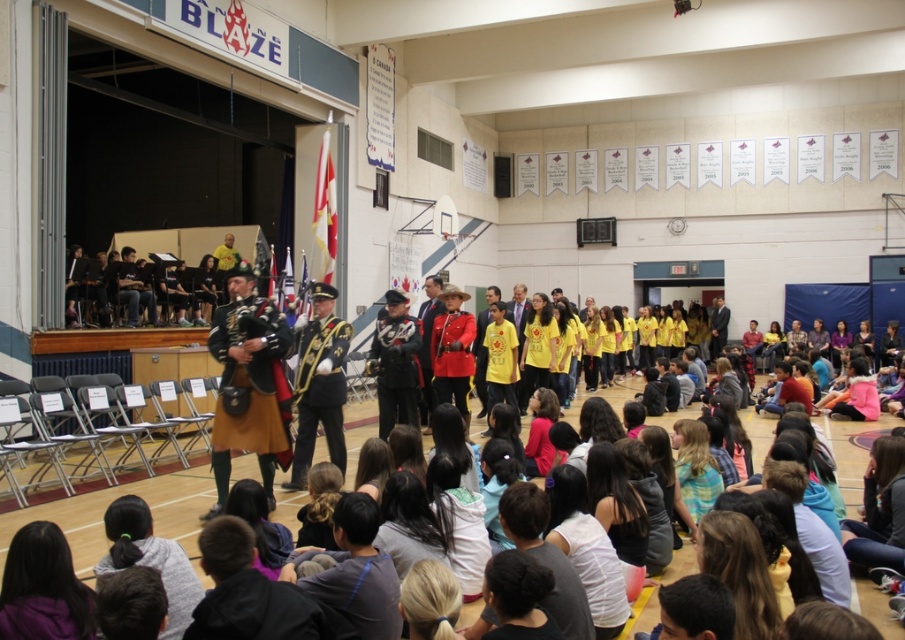
Question: Does brown leather kilt at center appear on the right side of red uniform at center?

Choices:
 (A) yes
 (B) no

Answer: (B)

Question: Estimate the real-world distances between objects in this image. Which object is closer to the black fabric at left?

Choices:
 (A) red uniform at center
 (B) shiny gold uniform at center

Answer: (A)

Question: Which of the following is the farthest from the observer?

Choices:
 (A) red uniform at center
 (B) black fabric at left
 (C) dark brown leather jacket at center

Answer: (C)

Question: Which of the following is the closest to the observer?

Choices:
 (A) black fabric at left
 (B) dark brown leather jacket at center
 (C) brown leather kilt at center
 (D) shiny gold uniform at center

Answer: (C)

Question: Can you confirm if red uniform at center is wider than black fabric at left?

Choices:
 (A) no
 (B) yes

Answer: (A)

Question: Does brown leather kilt at center appear over shiny gold uniform at center?

Choices:
 (A) no
 (B) yes

Answer: (B)